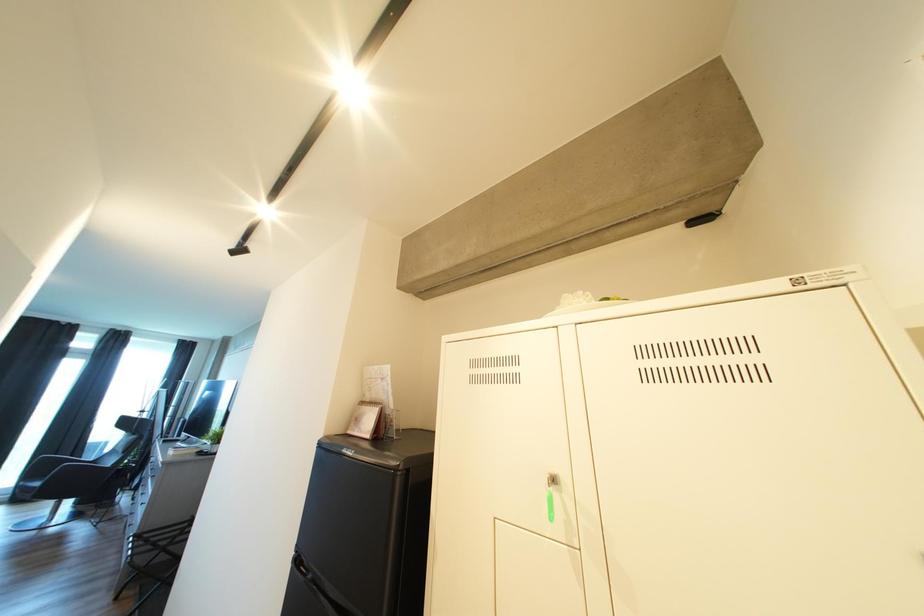
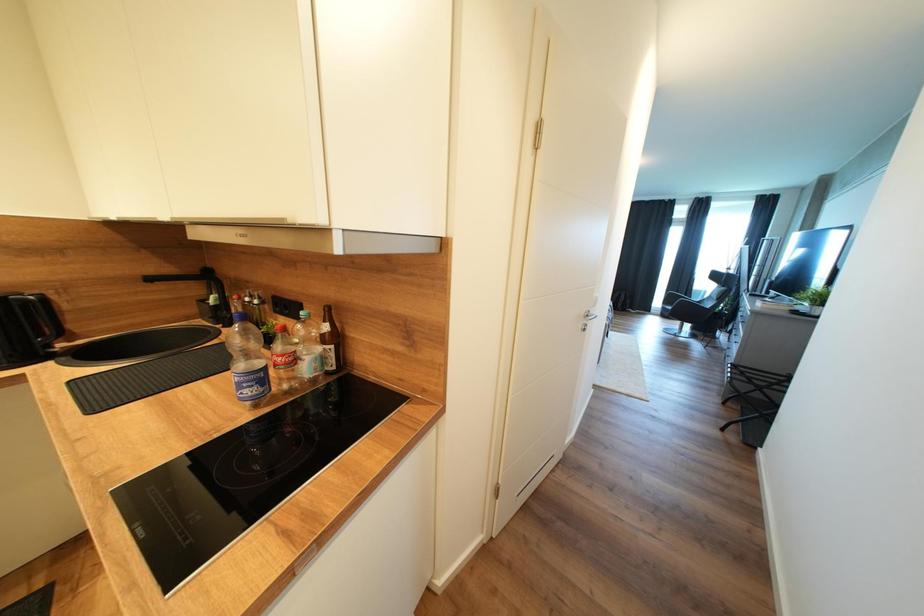
Question: How did the camera likely rotate?

Choices:
 (A) Left
 (B) Right
 (C) Up
 (D) Down

Answer: (A)